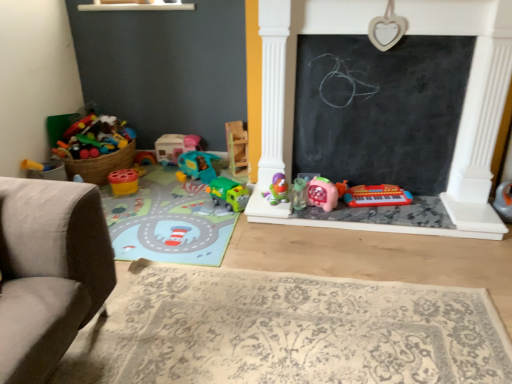
This screenshot has width=512, height=384. In order to click on free space in front of matte plastic toy car at center, the 9th toy when ordered from right to left in this screenshot , I will do `click(162, 173)`.